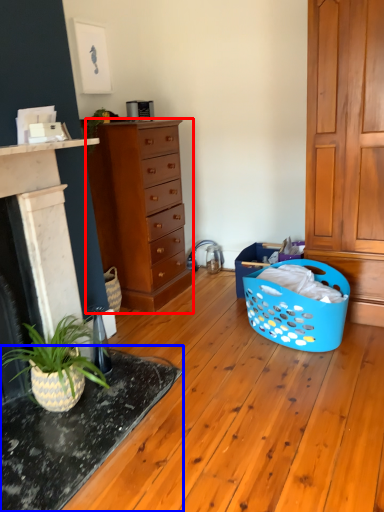
Question: Which object appears farthest to the camera in this image, chest of drawers (highlighted by a red box) or table (highlighted by a blue box)?

Choices:
 (A) chest of drawers
 (B) table

Answer: (A)